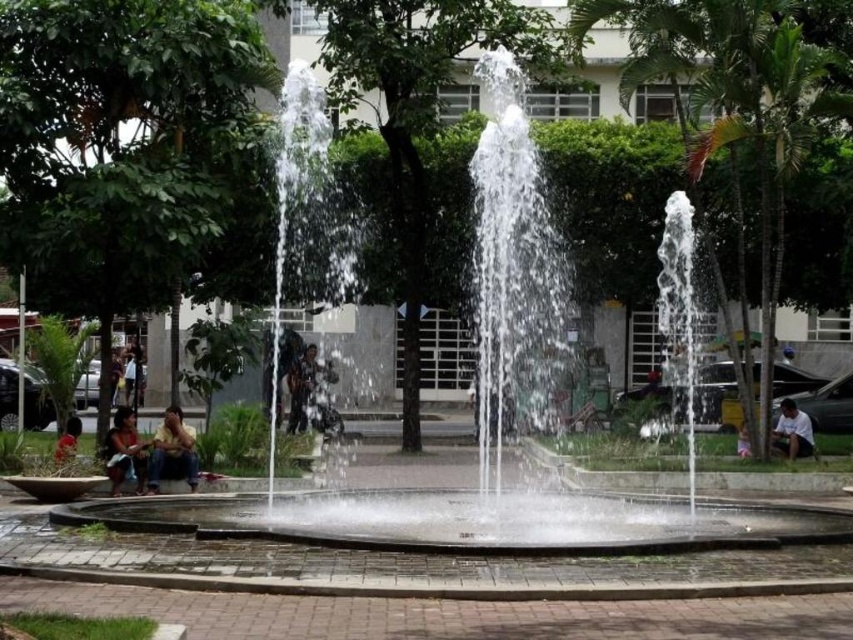
Is point (169, 419) less distant than point (746, 454)?

Yes, it is in front of point (746, 454).

You are a GUI agent. You are given a task and a screenshot of the screen. Output one action in this format:
    pyautogui.click(x=<x>, y=<y>)
    Task: Click on the yellow fabric shirt at lower left
    The width and height of the screenshot is (853, 640).
    Given the screenshot: What is the action you would take?
    pyautogui.click(x=172, y=451)

Find the location of `yellow fabric shirt at lower left`. yellow fabric shirt at lower left is located at coordinates coord(172,451).

Is yellow fabric shirt at lower left to the right of matte red shirt at lower left from the viewer's perspective?

Correct, you'll find yellow fabric shirt at lower left to the right of matte red shirt at lower left.

What do you see at coordinates (172, 451) in the screenshot? I see `yellow fabric shirt at lower left` at bounding box center [172, 451].

This screenshot has width=853, height=640. Identify the location of yellow fabric shirt at lower left. (172, 451).

From the picture: Who is more forward, (309, 348) or (793, 449)?

Positioned in front is point (793, 449).

Who is lower down, dark brown leather jacket at center or white cotton shirt at lower right?

Positioned lower is white cotton shirt at lower right.

Where is `dark brown leather jacket at center`? The image size is (853, 640). dark brown leather jacket at center is located at coordinates (305, 385).

Locate an element on the screen. dark brown leather jacket at center is located at coordinates (305, 385).